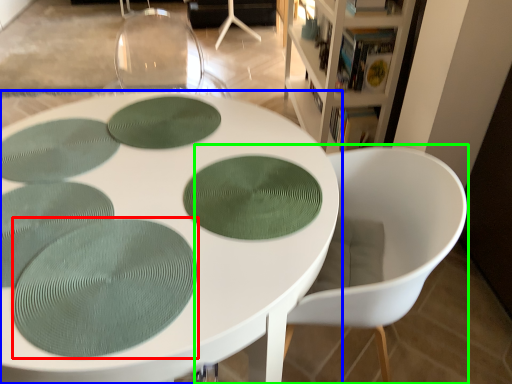
Question: Which object is positioned closest to oval (highlighted by a red box)? Select from table (highlighted by a blue box) and chair (highlighted by a green box).

Choices:
 (A) table
 (B) chair

Answer: (A)